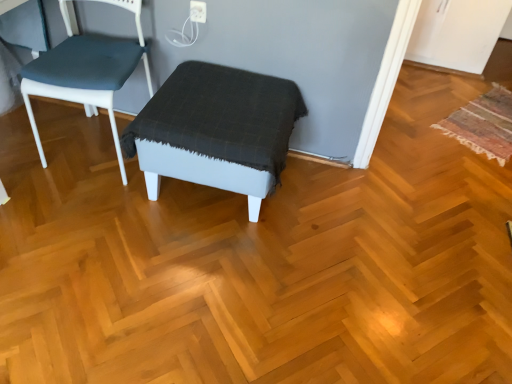
What are the coordinates of `spots to the right of matte gray stool at center` in the screenshot? It's located at (343, 219).